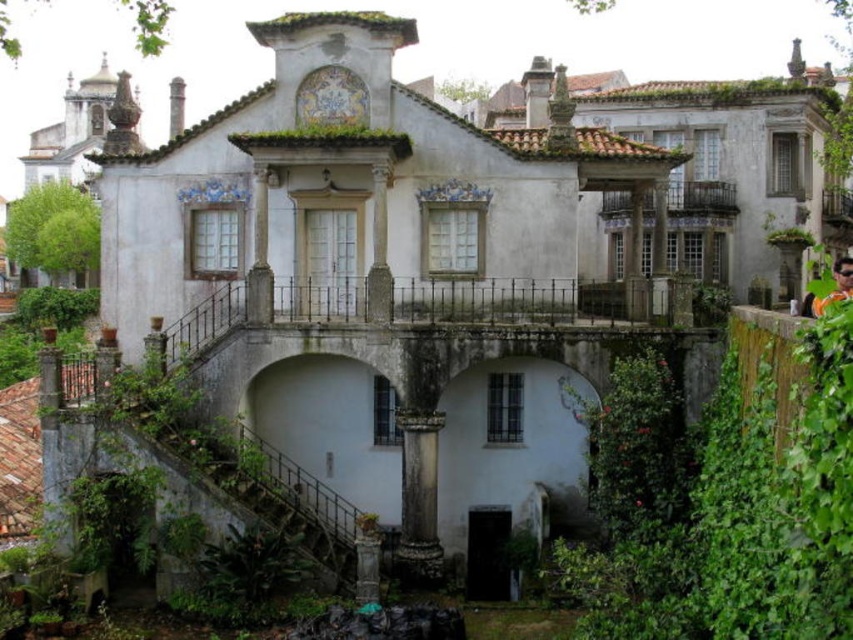
Question: Which of the following is the farthest from the observer?

Choices:
 (A) (838, 205)
 (B) (846, 273)
 (C) (589, 234)
 (D) (680, 195)

Answer: (A)

Question: Is white stucco mansion at center to the right of green leafy plant at upper right from the viewer's perspective?

Choices:
 (A) no
 (B) yes

Answer: (B)

Question: Which point is farther from the camera taking this photo?

Choices:
 (A) (831, 216)
 (B) (703, 202)
 (C) (828, 300)
 (D) (799, 250)

Answer: (A)

Question: Can you confirm if white painted wood balcony at upper right is smaller than green leafy plant at upper right?

Choices:
 (A) no
 (B) yes

Answer: (B)

Question: Is the position of white stucco mansion at center less distant than that of white painted wood balcony at upper right?

Choices:
 (A) yes
 (B) no

Answer: (A)

Question: Which of the following is the closest to the observer?

Choices:
 (A) (814, 316)
 (B) (827, 188)
 (C) (763, 218)

Answer: (A)